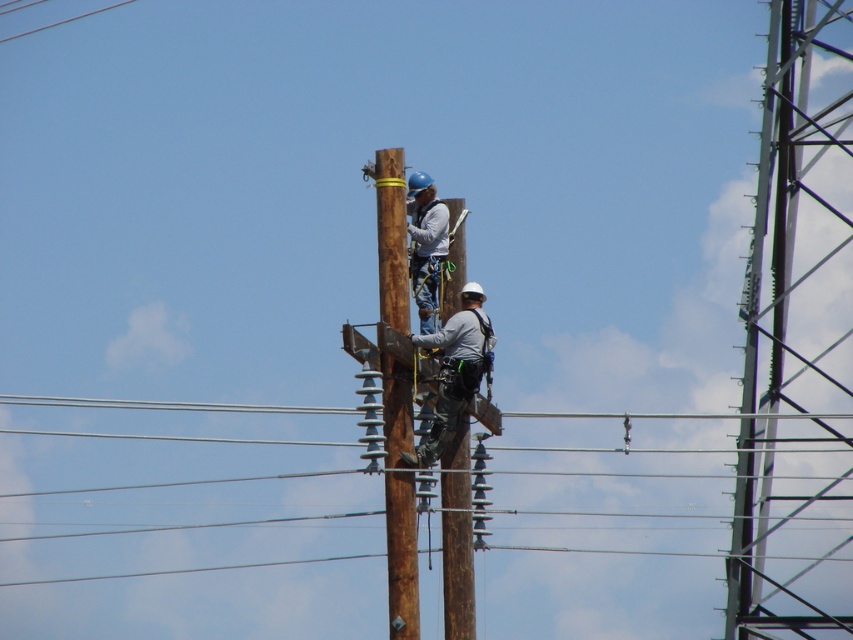
Question: Can you confirm if metallic gray tower at right is wider than clear blue wire at upper left?

Choices:
 (A) yes
 (B) no

Answer: (A)

Question: Which point is farther from the camera taking this photo?

Choices:
 (A) (782, 595)
 (B) (10, 36)

Answer: (B)

Question: Based on their relative distances, which object is nearer to the metallic gray tower at right?

Choices:
 (A) matte gray jacket at center
 (B) gray fabric construction worker at center
 (C) brown wooden telegraph pole at center
 (D) clear blue wire at upper left

Answer: (B)

Question: Does brown wooden telegraph pole at center appear over clear blue wire at upper left?

Choices:
 (A) no
 (B) yes

Answer: (A)

Question: Is metallic gray tower at right behind clear blue wire at upper left?

Choices:
 (A) no
 (B) yes

Answer: (A)

Question: Which object is the farthest from the gray fabric construction worker at center?

Choices:
 (A) metallic gray tower at right
 (B) clear blue wire at upper left

Answer: (B)